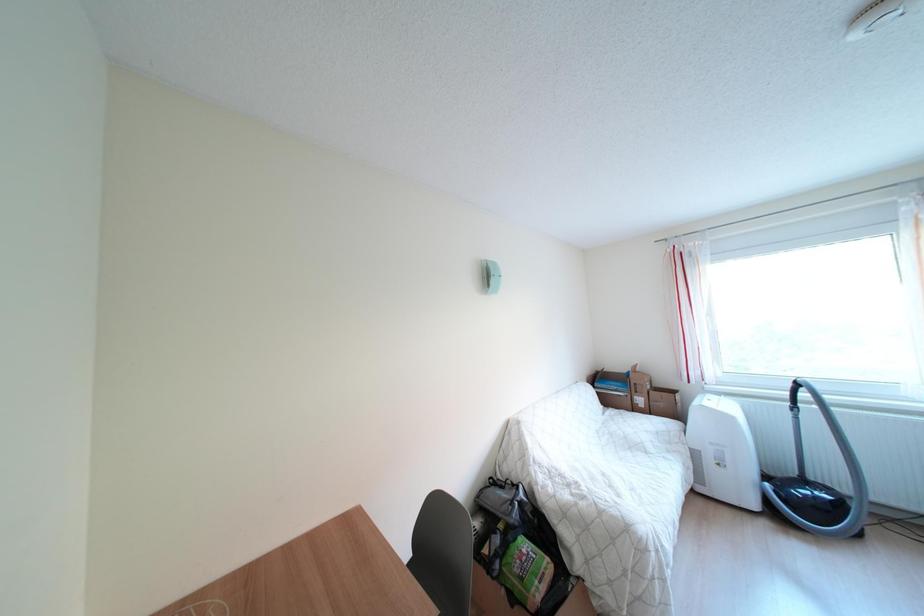
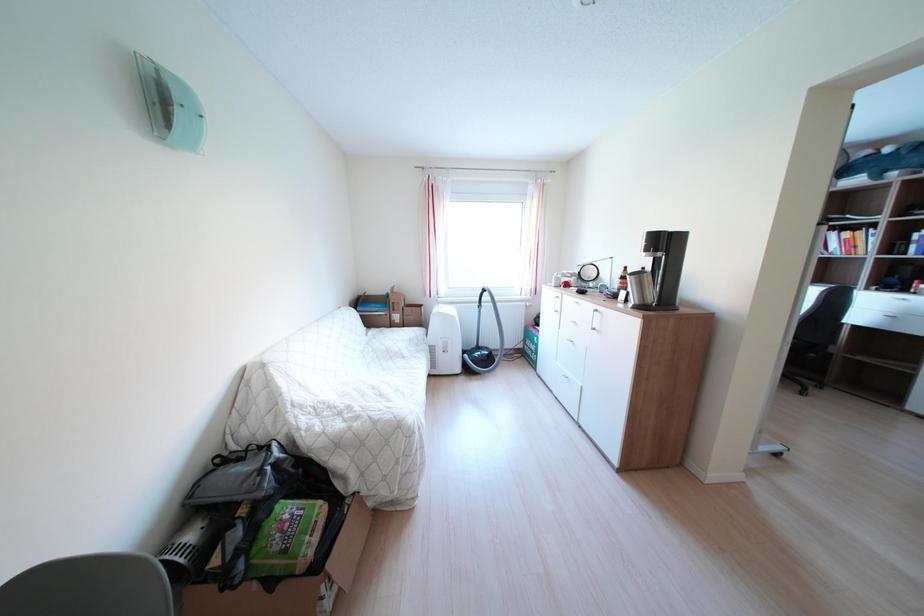
Question: The images are taken continuously from a first-person perspective. In which direction is your viewpoint rotating?

Choices:
 (A) Left
 (B) Right
 (C) Up
 (D) Down

Answer: (B)